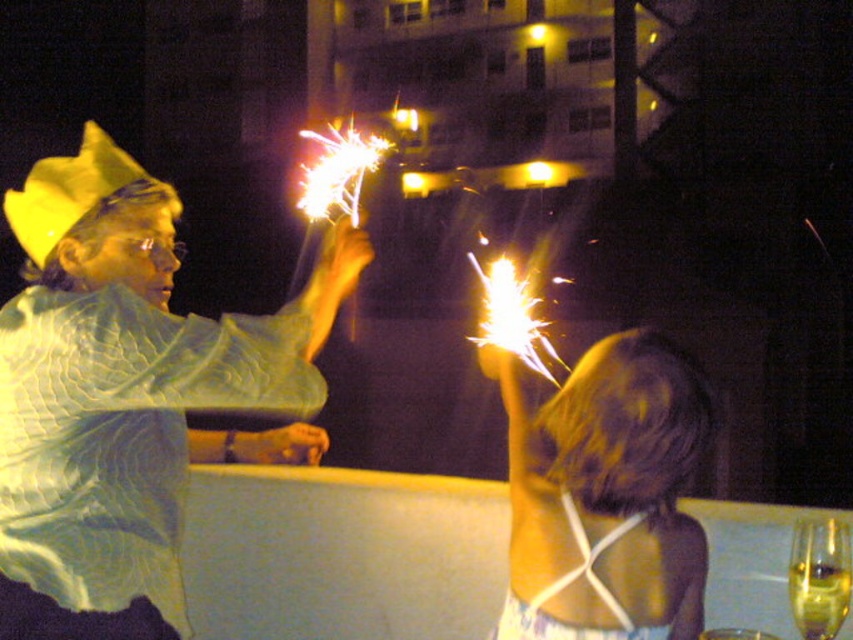
Question: Which point is farther to the camera?

Choices:
 (A) (596, 456)
 (B) (126, 253)

Answer: (B)

Question: Does matte green fabric at left lie behind blonde hair at upper right?

Choices:
 (A) no
 (B) yes

Answer: (A)

Question: Where is matte green fabric at left located in relation to blonde hair at upper right in the image?

Choices:
 (A) left
 (B) right

Answer: (A)

Question: Is matte green fabric at left above blonde hair at upper right?

Choices:
 (A) yes
 (B) no

Answer: (A)